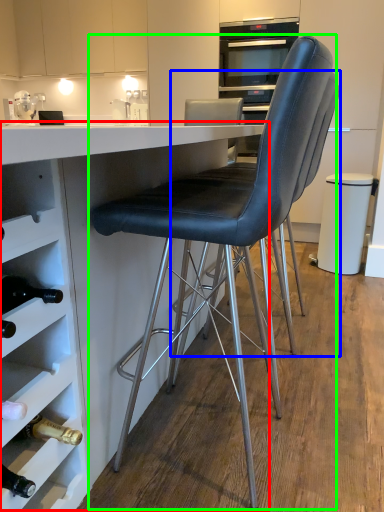
Question: Which object is positioned closest to table (highlighted by a red box)? Select from chair (highlighted by a blue box) and chair (highlighted by a green box).

Choices:
 (A) chair
 (B) chair

Answer: (B)